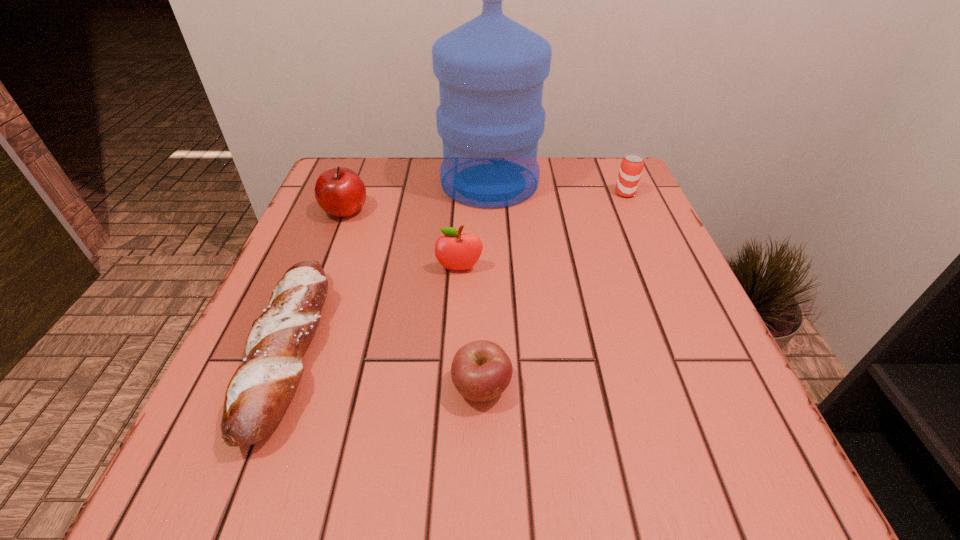
Where is `water jug`? water jug is located at coordinates (491, 70).

Locate an element on the screen. Image resolution: width=960 pixels, height=540 pixels. the leftmost apple is located at coordinates (340, 192).

Find the location of a particular element. Image resolution: width=960 pixels, height=540 pixels. the third nearest object is located at coordinates (455, 251).

The width and height of the screenshot is (960, 540). I want to click on the rightmost object, so click(x=631, y=168).

This screenshot has width=960, height=540. Identify the location of baguet. (259, 392).

You are a GUI agent. You are given a task and a screenshot of the screen. Output one action in this format:
    pyautogui.click(x=<x>, y=<y>)
    Task: Click on the shortest apple
    This screenshot has width=960, height=540.
    Given the screenshot: What is the action you would take?
    pyautogui.click(x=481, y=370)

Locate an element on the screen. The width and height of the screenshot is (960, 540). free space located 0.280m on the front of the tallest object is located at coordinates (493, 298).

Find the location of `vacant region located 0.080m on the back of the farthest apple`. vacant region located 0.080m on the back of the farthest apple is located at coordinates (357, 181).

Identify the location of free space located on the back of the third nearest object. This screenshot has width=960, height=540. (462, 227).

This screenshot has width=960, height=540. I want to click on vacant point located on the front of the rightmost object, so click(654, 257).